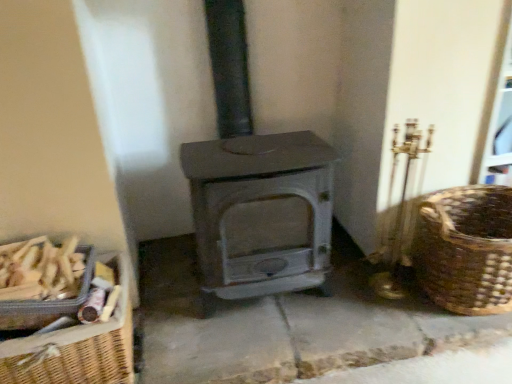
Question: From a real-world perspective, does brown woven basket at right, which is the 3th basket in left-to-right order, stand above matte gray wood burning stove at center?

Choices:
 (A) yes
 (B) no

Answer: (B)

Question: Is brown woven basket at right, placed as the 1th basket when sorted from right to left, not close to matte gray wood burning stove at center?

Choices:
 (A) no
 (B) yes

Answer: (A)

Question: Is brown woven basket at right, placed as the 1th basket when sorted from right to left, wider than matte gray wood burning stove at center?

Choices:
 (A) yes
 (B) no

Answer: (B)

Question: Is brown woven basket at right, which is the 3th basket in left-to-right order, shorter than matte gray wood burning stove at center?

Choices:
 (A) no
 (B) yes

Answer: (B)

Question: From the image's perspective, would you say brown woven basket at right, placed as the 1th basket when sorted from right to left, is positioned over matte gray wood burning stove at center?

Choices:
 (A) no
 (B) yes

Answer: (A)

Question: Considering the relative positions of brown woven basket at right, which is the 3th basket in left-to-right order, and matte gray wood burning stove at center in the image provided, is brown woven basket at right, which is the 3th basket in left-to-right order, to the left of matte gray wood burning stove at center from the viewer's perspective?

Choices:
 (A) no
 (B) yes

Answer: (A)

Question: Does matte gray wood burning stove at center come in front of woven brown basket at lower left, which is the 3th basket in right-to-left order?

Choices:
 (A) no
 (B) yes

Answer: (B)

Question: Is matte gray wood burning stove at center thinner than woven brown basket at lower left, which is the 3th basket in right-to-left order?

Choices:
 (A) yes
 (B) no

Answer: (B)

Question: Can you confirm if matte gray wood burning stove at center is bigger than woven brown basket at lower left, which is the 3th basket in right-to-left order?

Choices:
 (A) no
 (B) yes

Answer: (B)

Question: From a real-world perspective, does matte gray wood burning stove at center stand above woven brown basket at lower left, placed as the 1th basket when sorted from left to right?

Choices:
 (A) yes
 (B) no

Answer: (A)

Question: Considering the relative sizes of matte gray wood burning stove at center and woven brown basket at lower left, which is the 3th basket in right-to-left order, in the image provided, is matte gray wood burning stove at center taller than woven brown basket at lower left, which is the 3th basket in right-to-left order,?

Choices:
 (A) no
 (B) yes

Answer: (B)

Question: From the image's perspective, is matte gray wood burning stove at center over woven brown basket at lower left, which is the 3th basket in right-to-left order?

Choices:
 (A) no
 (B) yes

Answer: (B)

Question: Does matte gray wood burning stove at center have a greater width compared to woven wood basket at left, arranged as the 2th basket when viewed from the right?

Choices:
 (A) no
 (B) yes

Answer: (B)